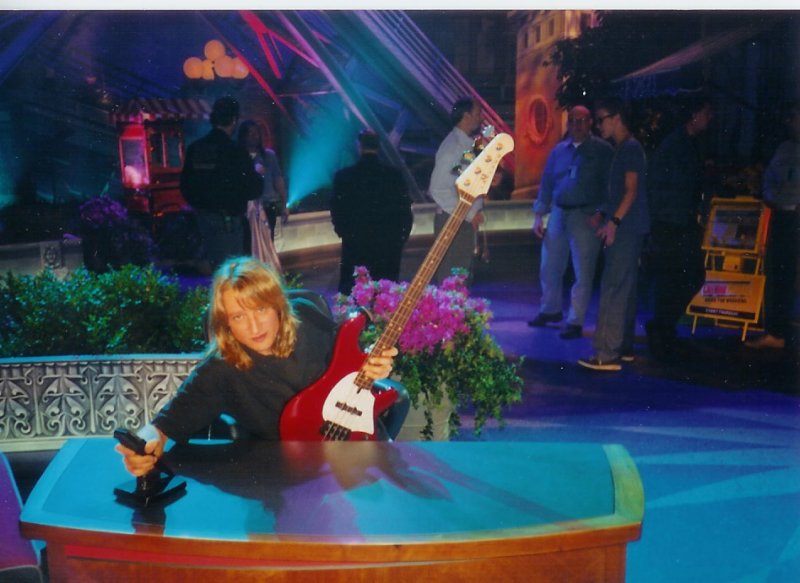
The height and width of the screenshot is (583, 800). Identify the location of desktop. (346, 501).